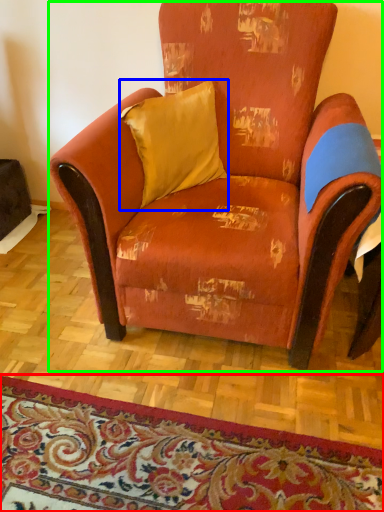
Question: Which object is the closest to the mat (highlighted by a red box)? Choose among these: pillow (highlighted by a blue box) or chair (highlighted by a green box).

Choices:
 (A) pillow
 (B) chair

Answer: (B)